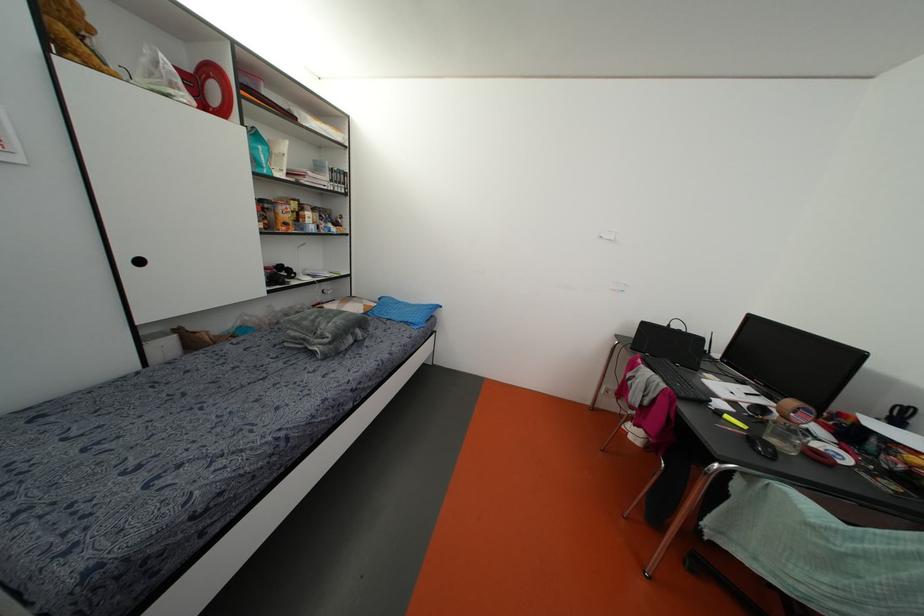
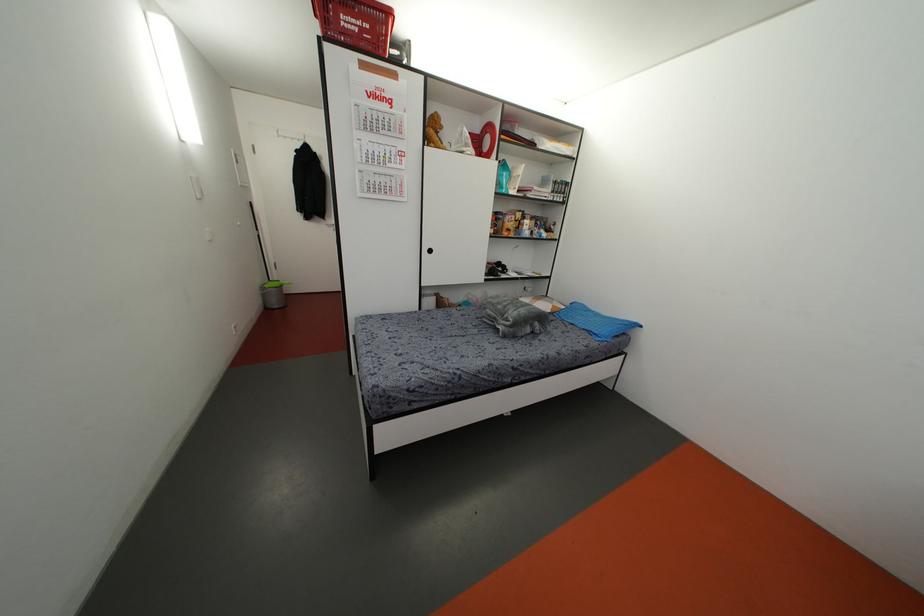
Where in the second image is the point corresponding to point 285,224 from the first image?

(507, 229)